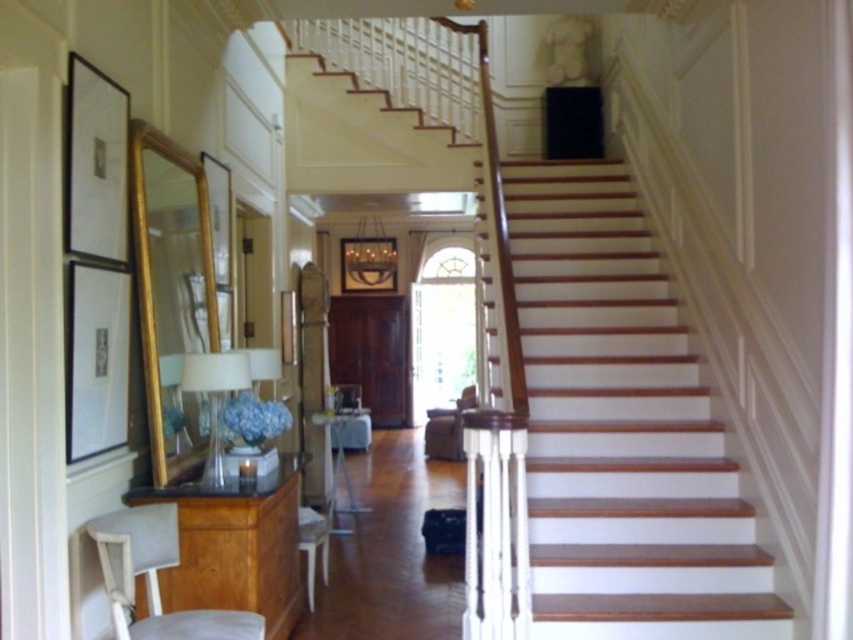
Question: Is matte black picture frame at left below wooden picture frame at center?

Choices:
 (A) yes
 (B) no

Answer: (B)

Question: Estimate the real-world distances between objects in this image. Which object is closer to the gold/gilded mirror at left?

Choices:
 (A) wooden frame at center
 (B) wooden picture frame at center

Answer: (B)

Question: Which is farther from the matte black picture frame at left?

Choices:
 (A) velvet brown armchair at center
 (B) wooden picture frame at center
 (C) gold/gilded mirror at left

Answer: (B)

Question: Can you confirm if beige fabric armchair at lower left is bigger than wooden picture frame at center?

Choices:
 (A) no
 (B) yes

Answer: (B)

Question: Which object is farther from the camera taking this photo?

Choices:
 (A) white wood stairs at upper center
 (B) beige fabric armchair at lower left
 (C) gold/gilded mirror at left
 (D) velvet brown armchair at center

Answer: (D)

Question: Is velvet brown armchair at center wider than wooden picture frame at center?

Choices:
 (A) yes
 (B) no

Answer: (A)